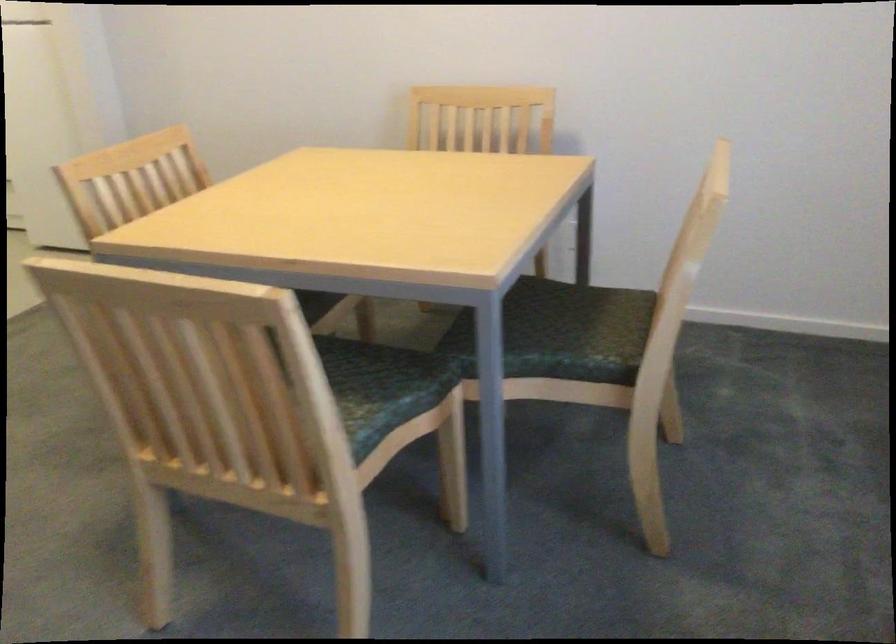
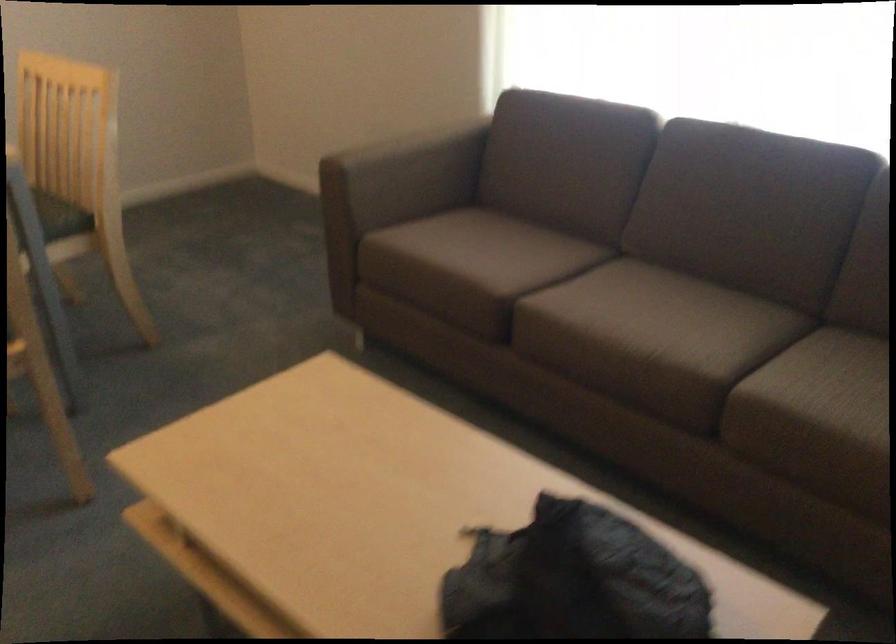
Where in the second image is the point corresponding to the point at 596,355 from the first image?

(61, 216)